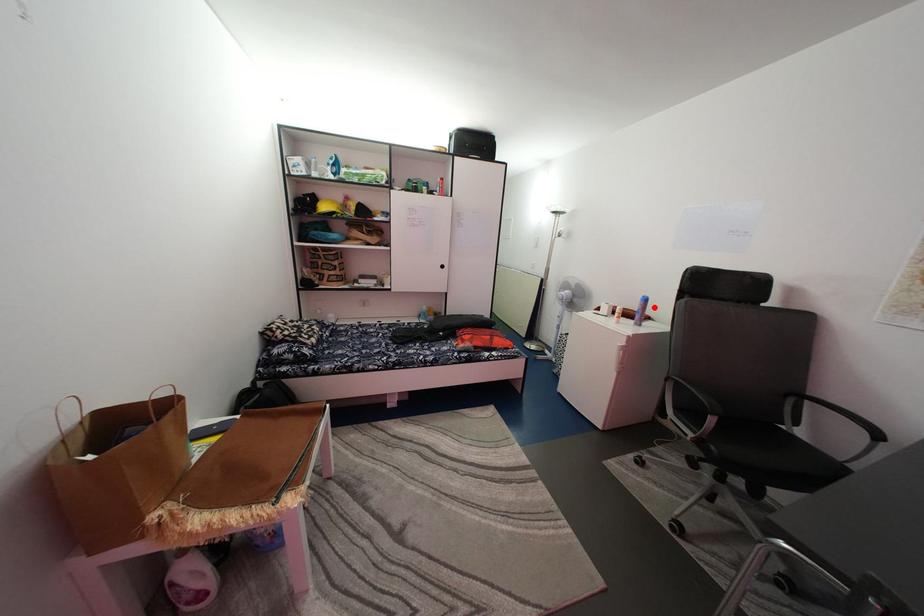
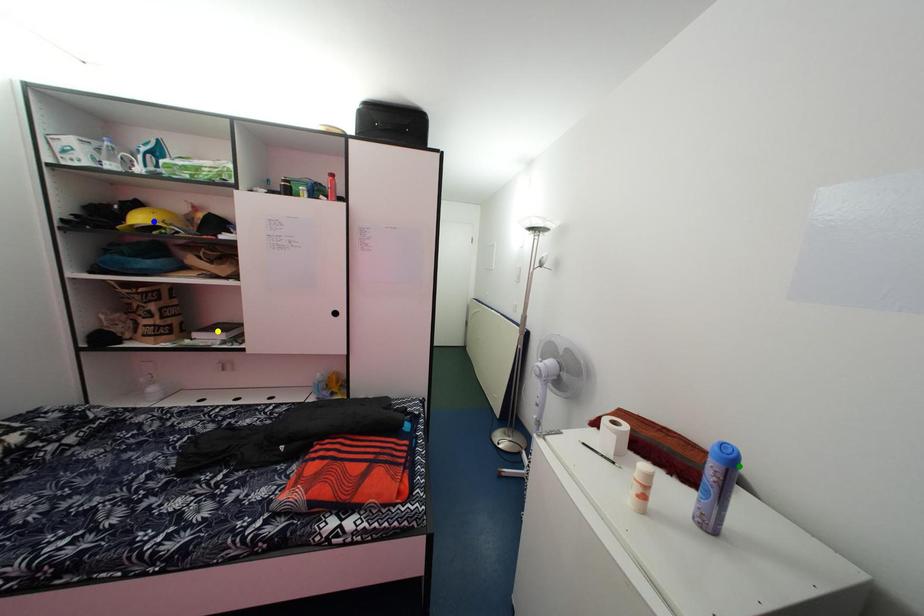
Question: I am providing you with two images of the same scene from different viewpoints. A red point is marked on the first image. You are given multiple points on the second image. Which mark in image 2 goes with the point in image 1?

Choices:
 (A) yellow point
 (B) green point
 (C) blue point

Answer: (B)